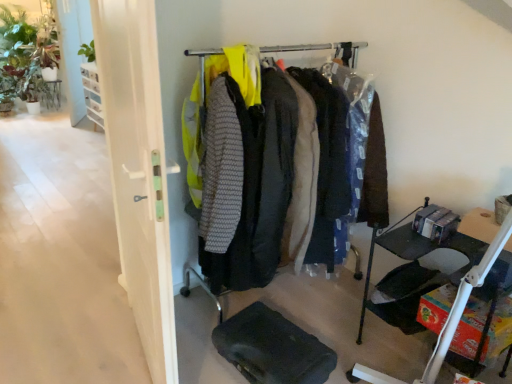
What is the approximate height of matte black tray at lower right?

matte black tray at lower right is 67.59 centimeters in height.

The image size is (512, 384). What do you see at coordinates (272, 348) in the screenshot?
I see `black rubber footrest at lower center` at bounding box center [272, 348].

At what (x,y) coordinates should I click in order to perform the action: click on matte black clothing rack at center. Please return your answer as a coordinate pair (x, y). The height and width of the screenshot is (384, 512). Looking at the image, I should click on (376, 170).

Locate an element on the screen. The width and height of the screenshot is (512, 384). matte black tray at lower right is located at coordinates (465, 301).

From the picture: Is black fabric folding chair at lower right placed right next to white glossy door at left?

black fabric folding chair at lower right and white glossy door at left are not in contact.

Can you confirm if black fabric folding chair at lower right is smaller than white glossy door at left?

Yes, black fabric folding chair at lower right is smaller than white glossy door at left.

From the image's perspective, is black fabric folding chair at lower right on top of white glossy door at left?

Actually, black fabric folding chair at lower right appears below white glossy door at left in the image.

From a real-world perspective, between black fabric folding chair at lower right and matte black clothing rack at center, who is vertically lower?

From a 3D spatial view, black fabric folding chair at lower right is below.

From the image's perspective, is black fabric folding chair at lower right under matte black clothing rack at center?

Yes, from the image's perspective, black fabric folding chair at lower right is below matte black clothing rack at center.

Considering the relative sizes of black fabric folding chair at lower right and matte black clothing rack at center in the image provided, is black fabric folding chair at lower right wider than matte black clothing rack at center?

No.

Is black fabric folding chair at lower right located outside matte black clothing rack at center?

That's correct, black fabric folding chair at lower right is outside of matte black clothing rack at center.

From the image's perspective, which object appears higher, white glossy door at left or black fabric folding chair at lower right?

From the image's view, white glossy door at left is above.

Is the position of white glossy door at left more distant than that of black fabric folding chair at lower right?

No, it is in front of black fabric folding chair at lower right.

Is point (132, 164) behind point (407, 279)?

No, (132, 164) is closer to viewer.

At what (x,y) coordinates should I click in order to perform the action: click on footrest behind the matte black tray at lower right. Please return your answer as a coordinate pair (x, y). Image resolution: width=512 pixels, height=384 pixels. Looking at the image, I should click on (272, 348).

How different are the orientations of matte black tray at lower right and black rubber footrest at lower center in degrees?

They differ by 9.21 degrees in their facing directions.

Which of these two, matte black tray at lower right or black rubber footrest at lower center, is smaller?

Smaller between the two is black rubber footrest at lower center.

Is matte black tray at lower right far away from black rubber footrest at lower center?

No, matte black tray at lower right is in close proximity to black rubber footrest at lower center.

Is matte black clothing rack at center next to white glossy door at left and touching it?

matte black clothing rack at center and white glossy door at left are not in contact.

Who is shorter, matte black clothing rack at center or white glossy door at left?

matte black clothing rack at center.

Which point is more forward, [370,129] or [127,181]?

Point [127,181]

From a real-world perspective, who is located lower, matte black clothing rack at center or white glossy door at left?

matte black clothing rack at center is physically lower.

Would you say matte black clothing rack at center contains matte black tray at lower right?

Actually, matte black tray at lower right is outside matte black clothing rack at center.

Which is in front, point (352, 67) or point (510, 213)?

The point (510, 213) is in front.

From the image's perspective, is matte black clothing rack at center above matte black tray at lower right?

Correct, matte black clothing rack at center appears higher than matte black tray at lower right in the image.

From the image's perspective, is black fabric folding chair at lower right above or below black rubber footrest at lower center?

From the image's perspective, black fabric folding chair at lower right appears above black rubber footrest at lower center.

From their relative heights in the image, would you say black fabric folding chair at lower right is taller or shorter than black rubber footrest at lower center?

Considering their sizes, black fabric folding chair at lower right has more height than black rubber footrest at lower center.

Where is `folding chair located below the white glossy door at left (from the image's perspective)`? The width and height of the screenshot is (512, 384). folding chair located below the white glossy door at left (from the image's perspective) is located at coordinates (404, 295).

Identify the location of folding chair located underneath the matte black clothing rack at center (from a real-world perspective). Image resolution: width=512 pixels, height=384 pixels. click(x=404, y=295).

Based on their spatial positions, is black rubber footrest at lower center or matte black clothing rack at center closer to white glossy door at left?

Among the two, black rubber footrest at lower center is located nearer to white glossy door at left.

From the image, which object appears to be farther from black rubber footrest at lower center, matte black clothing rack at center or white glossy door at left?

matte black clothing rack at center.

Considering their positions, is white glossy door at left positioned closer to matte black clothing rack at center than black rubber footrest at lower center?

Based on the image, black rubber footrest at lower center appears to be nearer to matte black clothing rack at center.

When comparing their distances from black fabric folding chair at lower right, does black rubber footrest at lower center or matte black tray at lower right seem closer?

Among the two, matte black tray at lower right is located nearer to black fabric folding chair at lower right.

Considering their positions, is matte black clothing rack at center positioned further to matte black tray at lower right than white glossy door at left?

white glossy door at left is positioned further to the anchor matte black tray at lower right.

When comparing their distances from black rubber footrest at lower center, does matte black tray at lower right or black fabric folding chair at lower right seem closer?

Based on the image, matte black tray at lower right appears to be nearer to black rubber footrest at lower center.

When comparing their distances from matte black clothing rack at center, does black fabric folding chair at lower right or black rubber footrest at lower center seem further?

Based on the image, black rubber footrest at lower center appears to be further to matte black clothing rack at center.

From the image, which object appears to be farther from black rubber footrest at lower center, matte black clothing rack at center or black fabric folding chair at lower right?

matte black clothing rack at center is further to black rubber footrest at lower center.

Locate an element on the screen. This screenshot has width=512, height=384. folding chair that lies between matte black clothing rack at center and black rubber footrest at lower center from top to bottom is located at coordinates (404, 295).

The width and height of the screenshot is (512, 384). Find the location of `closet between black rubber footrest at lower center and matte black tray at lower right in the horizontal direction`. closet between black rubber footrest at lower center and matte black tray at lower right in the horizontal direction is located at coordinates (376, 170).

Where is `the footrest situated between white glossy door at left and black fabric folding chair at lower right from left to right`? the footrest situated between white glossy door at left and black fabric folding chair at lower right from left to right is located at coordinates (272, 348).

I want to click on folding chair located between black rubber footrest at lower center and matte black tray at lower right in the left-right direction, so click(x=404, y=295).